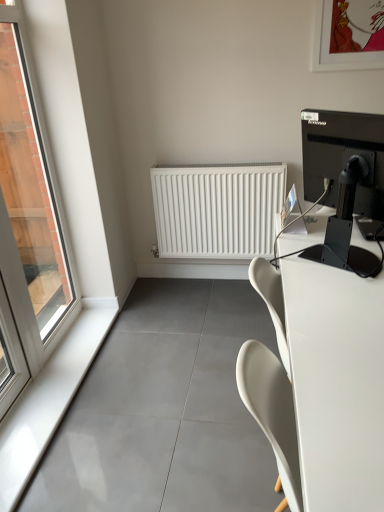
You are a GUI agent. You are given a task and a screenshot of the screen. Output one action in this format:
    pyautogui.click(x=<x>, y=<y>)
    Task: Click on the vacant point above white glossy window sill at left (from a real-world perspective)
    The image size is (384, 512).
    Given the screenshot: What is the action you would take?
    pyautogui.click(x=49, y=379)